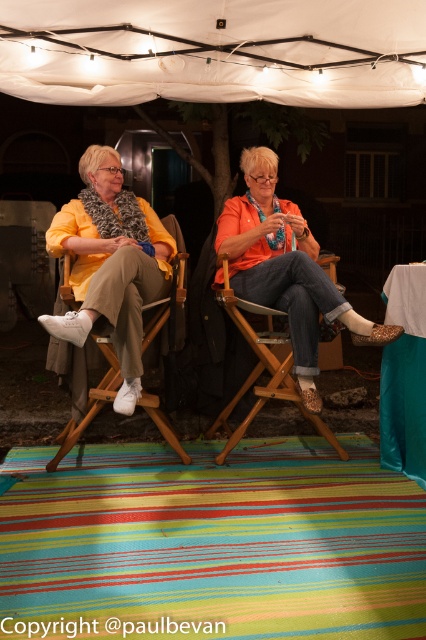
Who is taller, white fabric canopy at upper center or matte yellow jacket at center?

Standing taller between the two is matte yellow jacket at center.

How far apart are white fabric canopy at upper center and matte yellow jacket at center?

3.97 feet

Between point (135, 17) and point (103, 188), which one is positioned in front?

Point (135, 17) is in front.

Where is `white fabric canopy at upper center`? This screenshot has height=640, width=426. white fabric canopy at upper center is located at coordinates (215, 51).

Between white fabric canopy at upper center and orange fabric at center, which one is positioned lower?

orange fabric at center

Is point (20, 61) positioned behind point (264, 259)?

Yes, it is behind point (264, 259).

You are a GUI agent. You are given a task and a screenshot of the screen. Output one action in this format:
    pyautogui.click(x=<x>, y=<y>)
    Task: Click on the white fabric canopy at upper center
    This screenshot has height=640, width=426.
    Given the screenshot: What is the action you would take?
    pyautogui.click(x=215, y=51)

Who is positioned more to the right, matte yellow sweater at center or wooden chair at center?

matte yellow sweater at center

The height and width of the screenshot is (640, 426). What do you see at coordinates (290, 273) in the screenshot?
I see `matte yellow sweater at center` at bounding box center [290, 273].

Find the location of a particular element. Image resolution: width=426 pixels, height=640 pixels. matte yellow sweater at center is located at coordinates (290, 273).

At what (x,y) coordinates should I click in order to perform the action: click on matte yellow sweater at center. Please return your answer as a coordinate pair (x, y). This screenshot has height=640, width=426. Looking at the image, I should click on (290, 273).